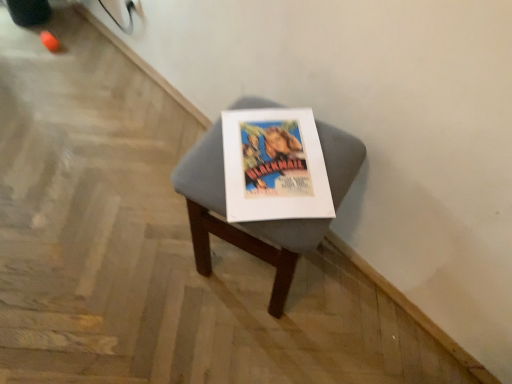
Locate an element on the screen. The width and height of the screenshot is (512, 384). vacant space to the right of gray fabric stool at center is located at coordinates (352, 309).